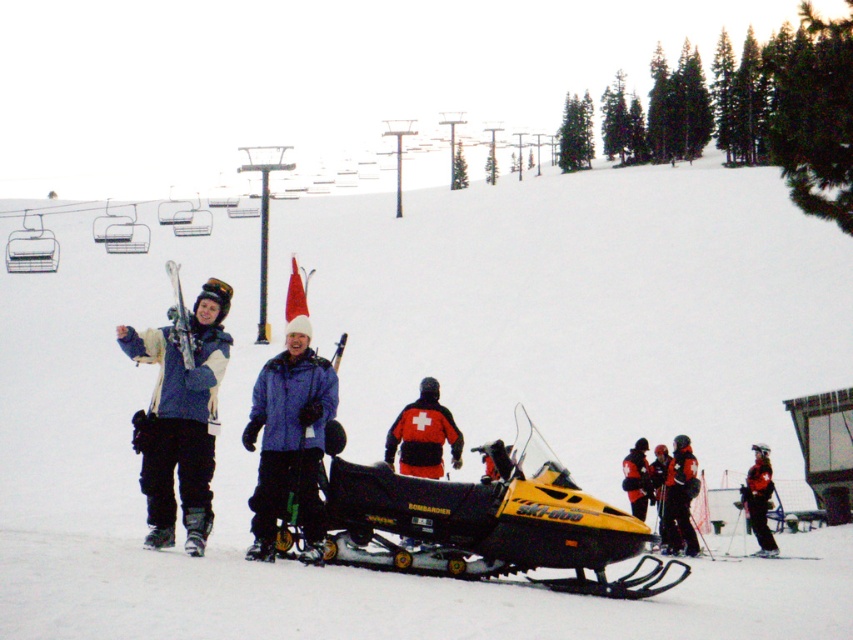
You are a photographer positioned at the center of the scene. You want to take a photo of the matte blue jacket at left and the red ski suit at center. Which one is closer to your current position?

The red ski suit at center is closer to your current position because it is at the center, while the matte blue jacket at left is positioned to the left of it.

You are a photographer trying to capture the yellow matte snowmobile at center and the black ski pants at center in the same frame. Based on their positions, which object is closer to the camera?

The yellow matte snowmobile at center is positioned over the black ski pants at center, meaning it is closer to the camera.

Looking at this image, you are a photographer trying to capture a clear photo of the yellow matte snowmobile at center and the black ski pants at center. Since the snowmobile is smaller in the frame, how can you adjust your camera position to ensure both objects are equally visible in the photo?

Since the yellow matte snowmobile at center is smaller than the black ski pants at center, you can move closer to the snowmobile to make it appear larger in the frame while maintaining the ski pants at a distance, ensuring both objects are equally visible.